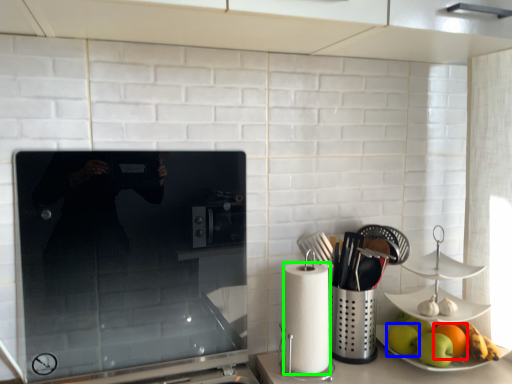
Question: Which is nearer to the orange (highlighted by a red box)? apple (highlighted by a blue box) or paper towel (highlighted by a green box).

Choices:
 (A) apple
 (B) paper towel

Answer: (A)